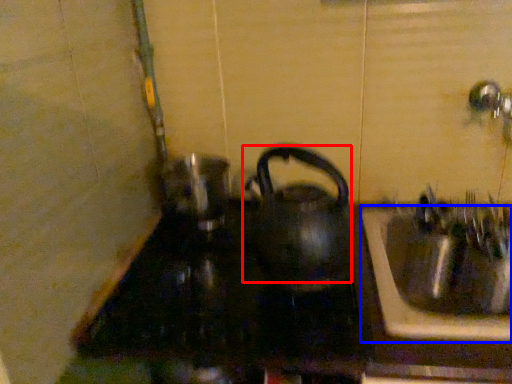
Question: Among these objects, which one is nearest to the camera, kettle (highlighted by a red box) or sink (highlighted by a blue box)?

Choices:
 (A) kettle
 (B) sink

Answer: (A)